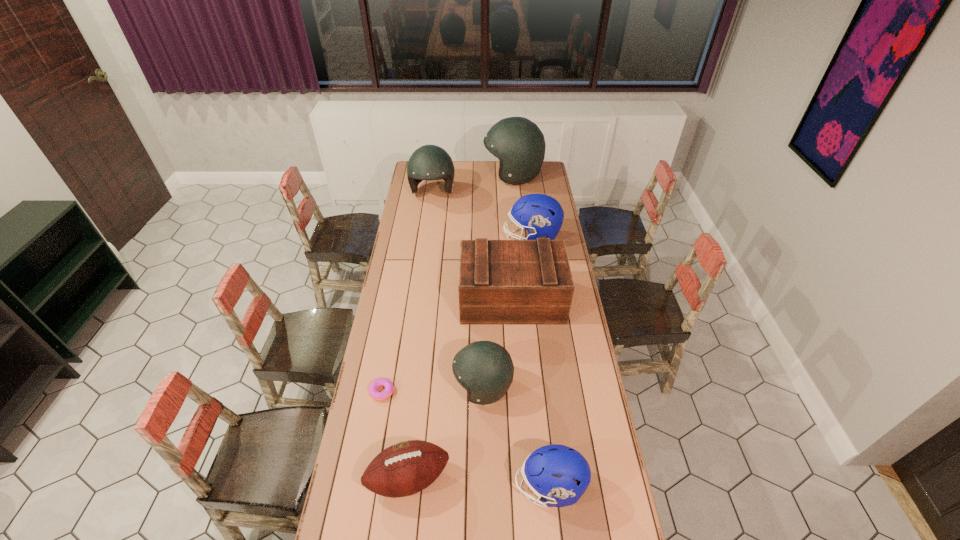
Where is `free point located 0.140m on the back of the doughnut`? free point located 0.140m on the back of the doughnut is located at coordinates (390, 351).

You are a GUI agent. You are given a task and a screenshot of the screen. Output one action in this format:
    pyautogui.click(x=<x>, y=<y>)
    Task: Click on the football helmet at the left edge
    The image size is (960, 540).
    Given the screenshot: What is the action you would take?
    pyautogui.click(x=429, y=162)

Where is `football (American) present at the left edge`? football (American) present at the left edge is located at coordinates (406, 468).

This screenshot has height=540, width=960. What are the coordinates of `doughnut that is at the left edge` in the screenshot? It's located at (389, 387).

Locate an element on the screen. The width and height of the screenshot is (960, 540). box located at the right edge is located at coordinates (501, 282).

At what (x,y) coordinates should I click in order to perform the action: click on object that is at the far left corner. Please return your answer as a coordinate pair (x, y). Image resolution: width=960 pixels, height=540 pixels. Looking at the image, I should click on (429, 162).

Identify the location of object that is at the far right corner. The height and width of the screenshot is (540, 960). (518, 143).

Locate an element on the screen. The height and width of the screenshot is (540, 960). vacant region at the far edge of the desktop is located at coordinates (497, 180).

In the image, there is a desktop. Where is `free space at the left edge`? The image size is (960, 540). free space at the left edge is located at coordinates (420, 301).

Locate an element on the screen. The image size is (960, 540). free space at the right edge is located at coordinates (572, 359).